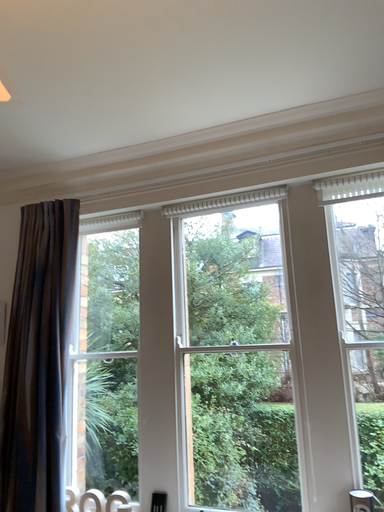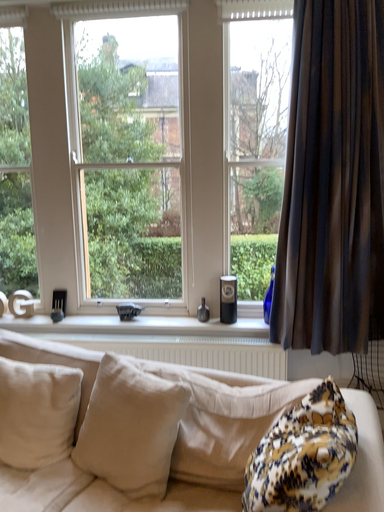
Question: How did the camera likely rotate when shooting the video?

Choices:
 (A) rotated left
 (B) rotated right

Answer: (B)